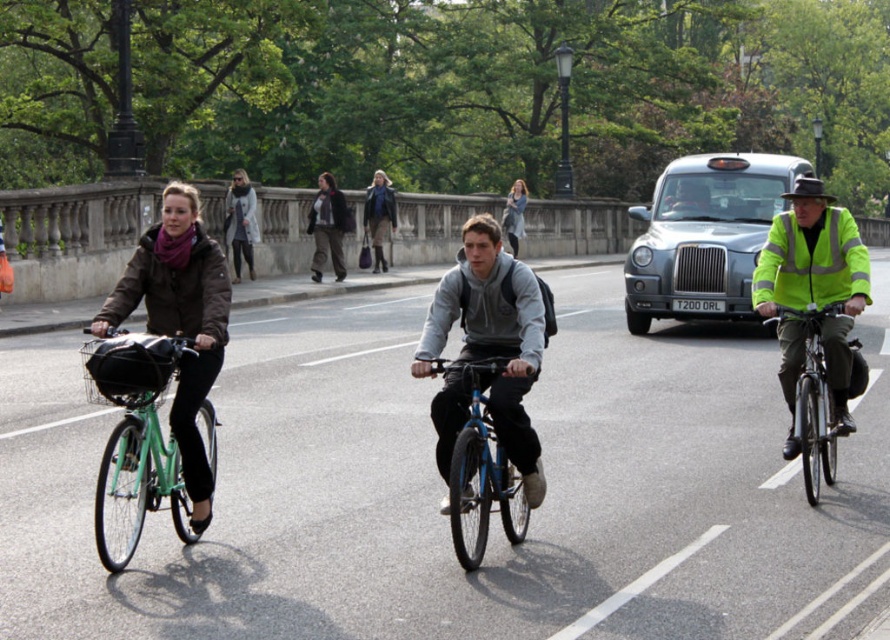
Based on the photo, you are a delivery person who needs to choose between the green matte bicycle at left and the blue metallic bicycle at center for a job that requires carrying heavy packages. Which bicycle would be more suitable based on their heights?

The green matte bicycle at left is much taller than the blue metallic bicycle at center, so it would be more suitable for carrying heavy packages as taller bicycles typically have a higher handlebar and frame design, making them more stable for carrying loads.